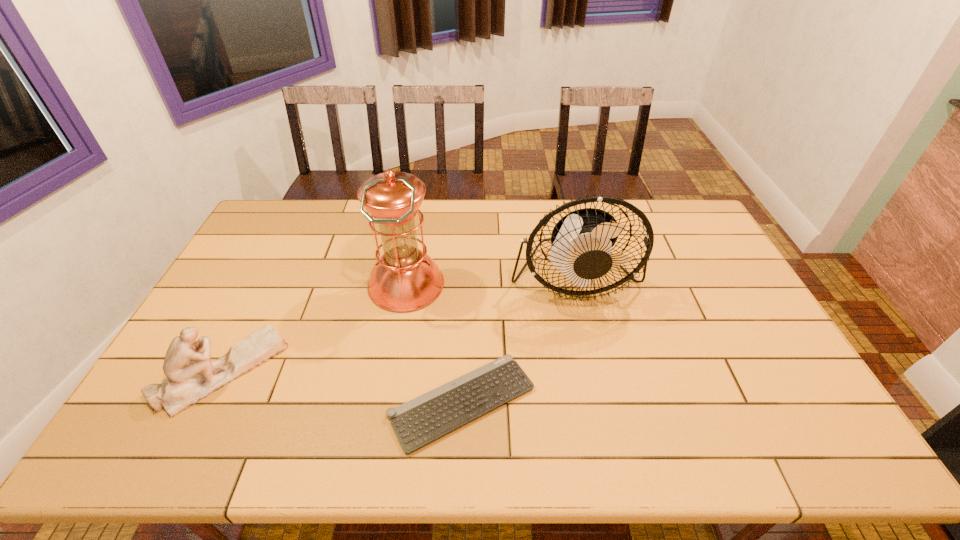
What are the coordinates of `oil lamp` in the screenshot? It's located at (405, 278).

This screenshot has width=960, height=540. I want to click on fan, so click(x=582, y=241).

Identify the location of figurine. (191, 376).

Locate an element on the screen. Image resolution: width=960 pixels, height=540 pixels. the leftmost object is located at coordinates (191, 376).

The height and width of the screenshot is (540, 960). I want to click on the shortest object, so click(418, 422).

Where is `free spot located on the front of the oil lamp`? The height and width of the screenshot is (540, 960). free spot located on the front of the oil lamp is located at coordinates (389, 383).

Locate an element on the screen. free location located 0.320m in front of the fan, directing airflow is located at coordinates (605, 412).

Image resolution: width=960 pixels, height=540 pixels. I want to click on free space located 0.370m on the front-facing side of the leftmost object, so click(x=419, y=371).

Find the location of a particular element. The height and width of the screenshot is (540, 960). vacant space situated on the left of the shortest object is located at coordinates (229, 402).

Where is `object at the near edge`? The height and width of the screenshot is (540, 960). object at the near edge is located at coordinates (418, 422).